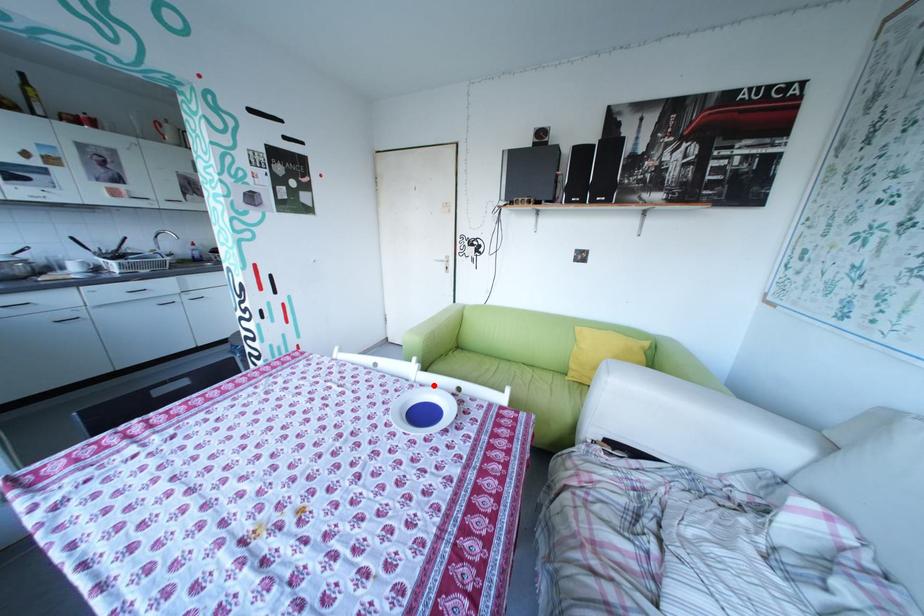
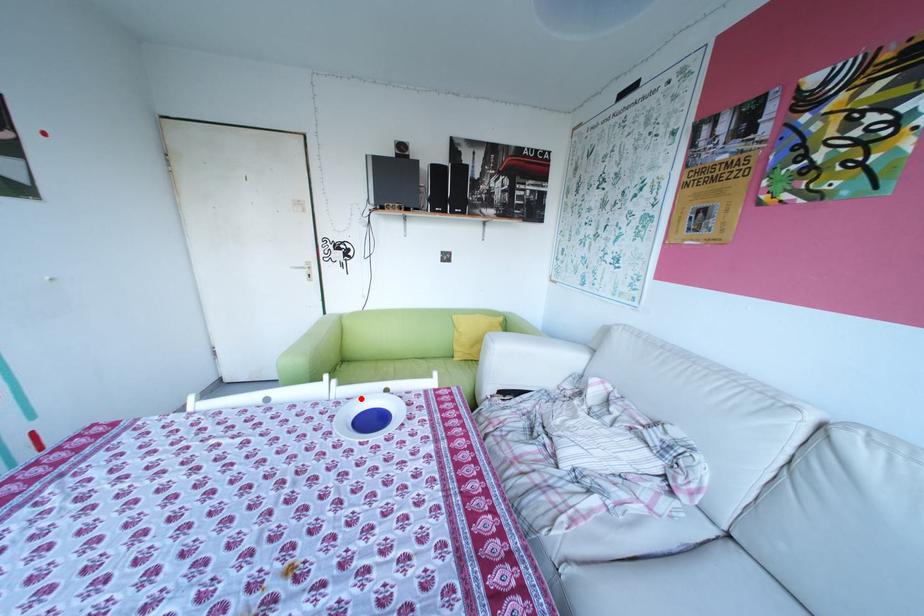
I am providing you with two images of the same scene from different viewpoints. A red point is marked on the first image and another point is marked on the second image. Is the marked point in image1 the same physical position as the marked point in image2?

Yes